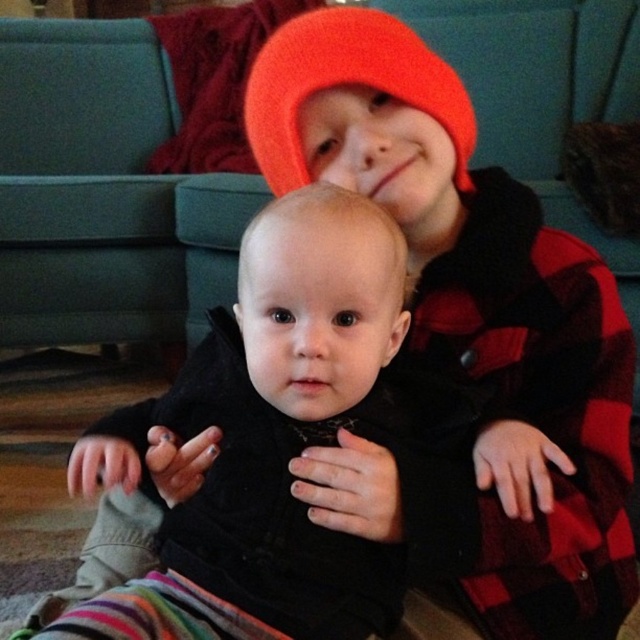
You are a photographer trying to capture a closeup of the black matte baby at center without the orange knit beanie at upper center appearing in the background. Is this possible given their current positions?

Yes, since the black matte baby at center is in front of the orange knit beanie at upper center, the photographer can adjust the camera angle or focus to ensure only the baby is in the frame while the beanie is out of view.

You are a photographer setting up for a family photo shoot in this living room. You need to position a small stool between the black matte baby at center and the orange knit beanie at upper center so that it fits snugly without overlapping either. Given the spatial relationship between these two objects, can you determine which side of the stool should face the wider object?

The black matte baby at center is wider than the orange knit beanie at upper center. Therefore, the side of the stool facing the black matte baby at center should be wider to accommodate its greater width, ensuring a snug fit without overlapping.